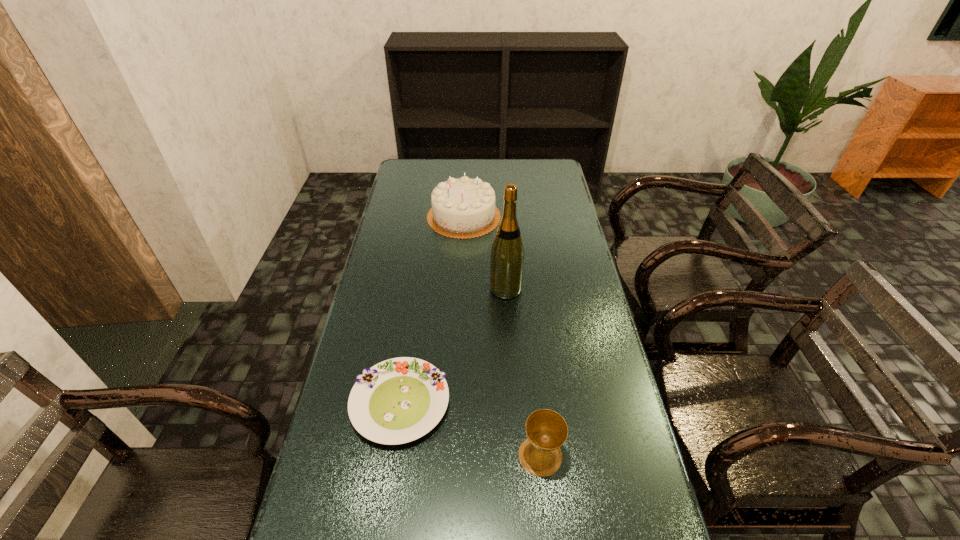
At what (x,y) coordinates should I click in order to perform the action: click on vacant space located 0.270m on the left of the chalice. Please return your answer as a coordinate pair (x, y). Looking at the image, I should click on (405, 456).

The image size is (960, 540). I want to click on vacant space positioned 0.380m on the right of the shortest object, so click(x=594, y=403).

You are a GUI agent. You are given a task and a screenshot of the screen. Output one action in this format:
    pyautogui.click(x=<x>, y=<y>)
    Task: Click on the object positioned at the left edge
    The height and width of the screenshot is (540, 960).
    Given the screenshot: What is the action you would take?
    pyautogui.click(x=399, y=400)

Find the location of a particular element. This screenshot has height=540, width=960. free space at the far edge is located at coordinates (503, 172).

In order to click on free space at the left edge of the desktop in this screenshot , I will do `click(393, 295)`.

Find the location of a particular element. The image size is (960, 540). free point at the right edge is located at coordinates (561, 212).

Where is `free point at the far left corner`? The height and width of the screenshot is (540, 960). free point at the far left corner is located at coordinates (395, 180).

Identify the location of free location at the far right corner. The image size is (960, 540). (553, 170).

At what (x,y) coordinates should I click in order to perform the action: click on free space between the third tallest object and the birthday cake. Please return your answer as a coordinate pair (x, y). The width and height of the screenshot is (960, 540). Looking at the image, I should click on (502, 336).

Where is `vacant space that is in between the third shortest object and the salad plate`? Image resolution: width=960 pixels, height=540 pixels. vacant space that is in between the third shortest object and the salad plate is located at coordinates (432, 310).